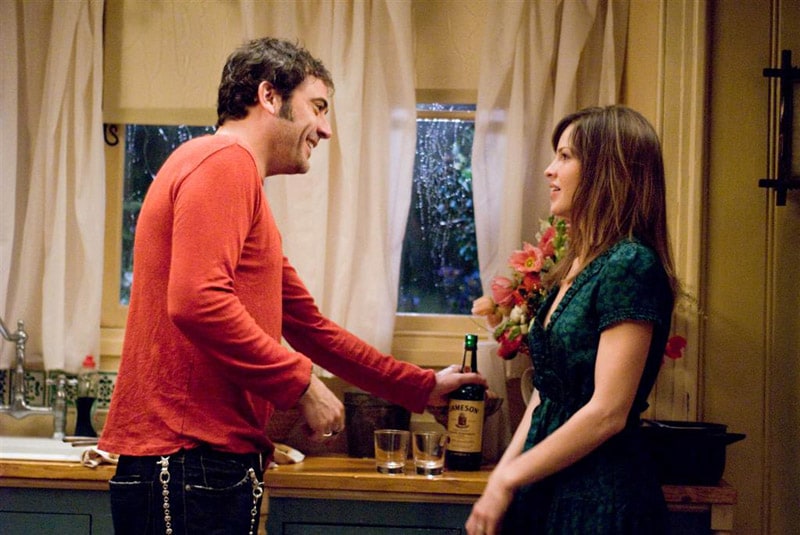
The height and width of the screenshot is (535, 800). I want to click on window, so click(458, 217), click(146, 142).